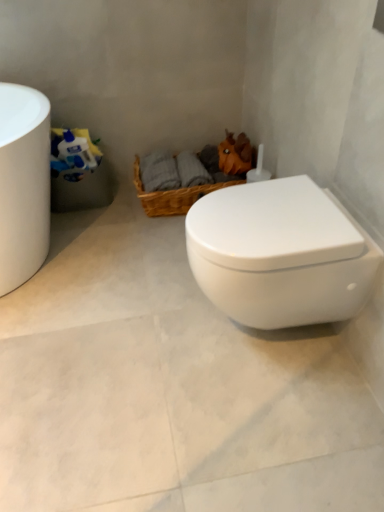
Question: Considering their positions, is white glossy toilet at center located in front of or behind white glossy toilet at center?

Choices:
 (A) front
 (B) behind

Answer: (B)

Question: From a real-world perspective, relative to white glossy toilet at center, is white glossy toilet at center vertically above or below?

Choices:
 (A) below
 (B) above

Answer: (B)

Question: Estimate the real-world distances between objects in this image. Which object is farther from the white glossy toilet paper at left?

Choices:
 (A) white glossy toilet at center
 (B) white glossy toilet at center
 (C) woven brown basket at center

Answer: (A)

Question: Considering the real-world distances, which object is farthest from the white glossy toilet at center?

Choices:
 (A) white glossy toilet at center
 (B) white glossy toilet paper at left
 (C) woven brown basket at center

Answer: (B)